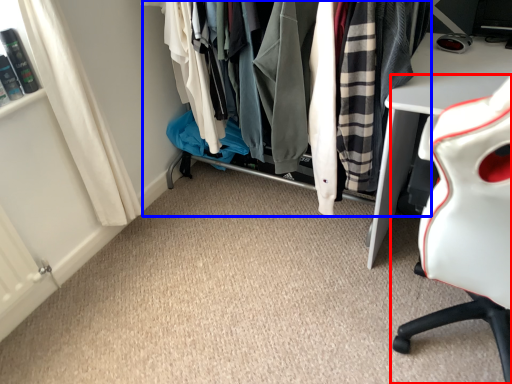
Question: Which object appears closest to the camera in this image, chair (highlighted by a red box) or closet (highlighted by a blue box)?

Choices:
 (A) chair
 (B) closet

Answer: (A)